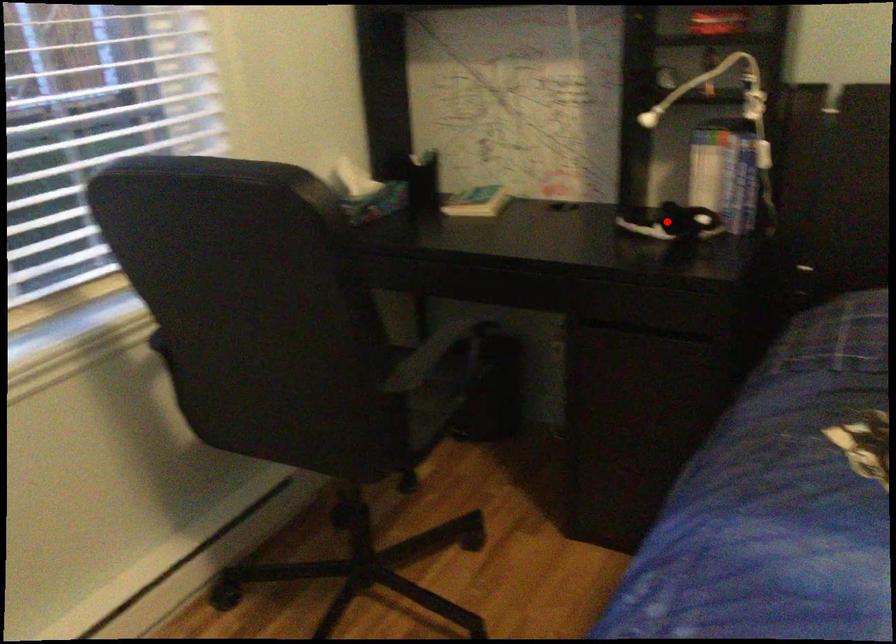
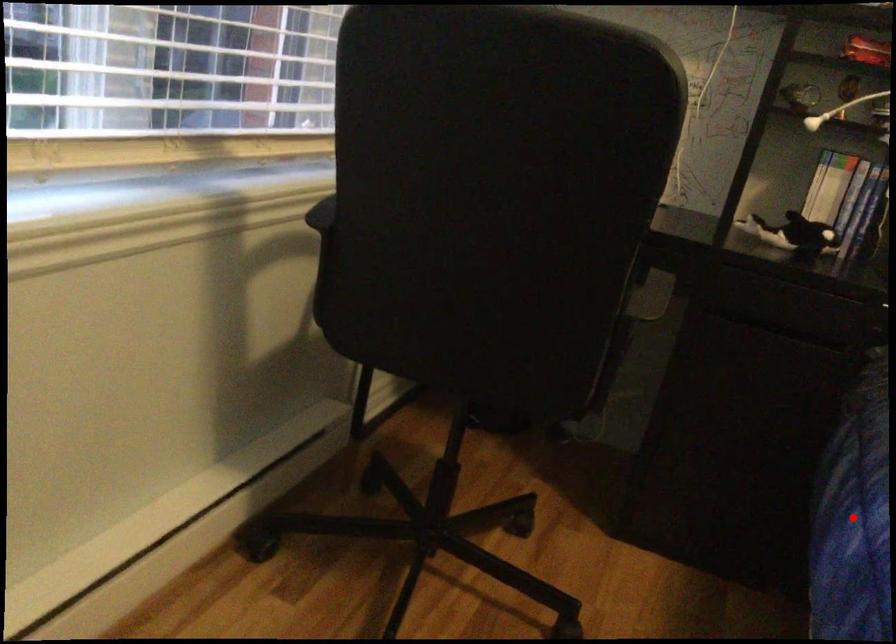
I am providing you with two images of the same scene from different viewpoints. A red point is marked on the first image and another point is marked on the second image. Do the highlighted points in image1 and image2 indicate the same real-world spot?

No